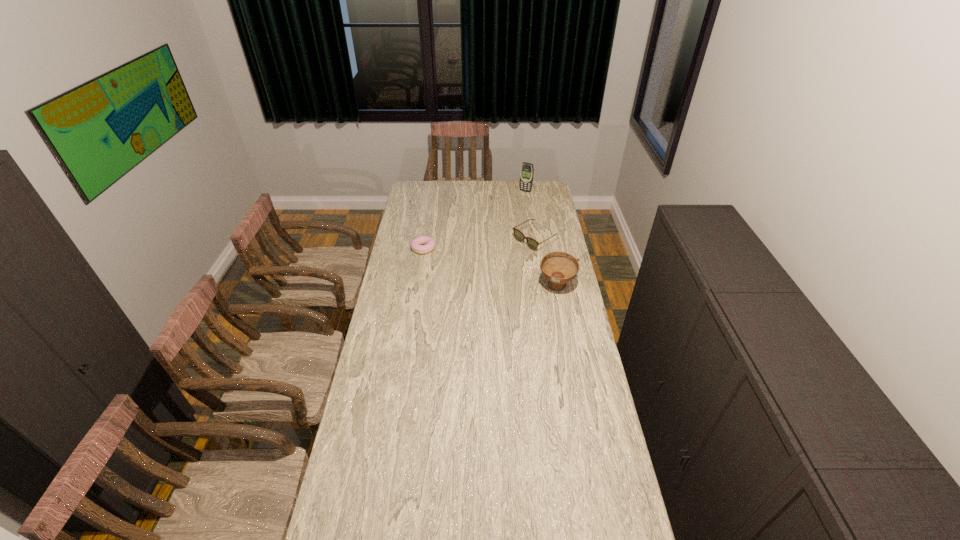
Locate an element on the screen. vacant space on the desktop that is between the leftmost object and the second tallest object and is positioned at the front view of the second shortest object is located at coordinates (487, 267).

I want to click on vacant space on the desktop that is between the shortest object and the second tallest object and is positioned on the screen of the farthest object, so click(x=476, y=264).